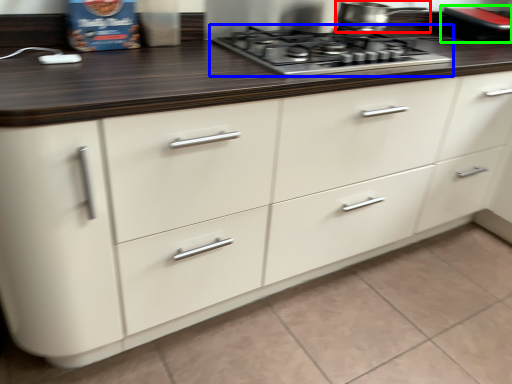
Question: Considering the real-world distances, which object is farthest from kitchen appliance (highlighted by a red box)? gas stove (highlighted by a blue box) or appliance (highlighted by a green box)?

Choices:
 (A) gas stove
 (B) appliance

Answer: (B)